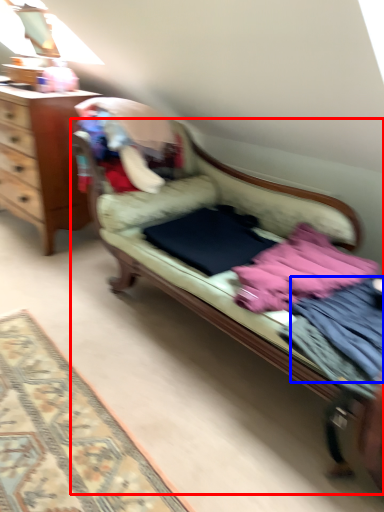
Question: Which of the following is the farthest to the observer, studio couch (highlighted by a red box) or clothing (highlighted by a blue box)?

Choices:
 (A) studio couch
 (B) clothing

Answer: (B)